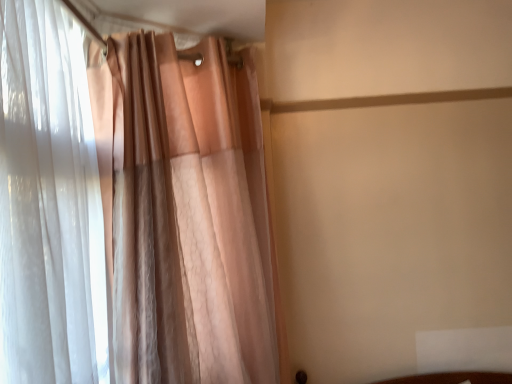
Where is `translucent pink curtain at left, which is counted as the second curtain, starting from the left`? This screenshot has height=384, width=512. translucent pink curtain at left, which is counted as the second curtain, starting from the left is located at coordinates (183, 212).

What do you see at coordinates (183, 212) in the screenshot?
I see `translucent pink curtain at left, which is counted as the second curtain, starting from the left` at bounding box center [183, 212].

In order to face translucent pink curtain at left, which is counted as the 1th curtain, starting from the right, should I rotate leftwards or rightwards?

A 4.002 degree turn to the left will do.

Measure the distance between translucent white curtain at left, which appears as the 1th curtain when viewed from the left, and camera.

They are 32.12 inches apart.

Describe the element at coordinates (49, 204) in the screenshot. The height and width of the screenshot is (384, 512). I see `translucent white curtain at left, the second curtain positioned from the right` at that location.

Find the location of a particular element. translucent white curtain at left, which appears as the 1th curtain when viewed from the left is located at coordinates (49, 204).

Locate an element on the screen. This screenshot has height=384, width=512. translucent pink curtain at left, which is counted as the second curtain, starting from the left is located at coordinates (183, 212).

In the image, is translucent pink curtain at left, which is counted as the second curtain, starting from the left, on the left side or the right side of translucent white curtain at left, which appears as the 1th curtain when viewed from the left?

Clearly, translucent pink curtain at left, which is counted as the second curtain, starting from the left, is on the right of translucent white curtain at left, which appears as the 1th curtain when viewed from the left, in the image.

Relative to translucent white curtain at left, the second curtain positioned from the right, is translucent pink curtain at left, which is counted as the second curtain, starting from the left, in front or behind?

In the image, translucent pink curtain at left, which is counted as the second curtain, starting from the left, appears behind translucent white curtain at left, the second curtain positioned from the right.

Does point (259, 349) lie in front of point (52, 161)?

No, (259, 349) is further to viewer.

From the image's perspective, is translucent pink curtain at left, which is counted as the 1th curtain, starting from the right, located beneath translucent white curtain at left, which appears as the 1th curtain when viewed from the left?

Yes.

From a real-world perspective, is translucent pink curtain at left, which is counted as the second curtain, starting from the left, physically located above or below translucent white curtain at left, which appears as the 1th curtain when viewed from the left?

Clearly, from a real-world perspective, translucent pink curtain at left, which is counted as the second curtain, starting from the left, is below translucent white curtain at left, which appears as the 1th curtain when viewed from the left.

Which of these two, translucent pink curtain at left, which is counted as the second curtain, starting from the left, or translucent white curtain at left, which appears as the 1th curtain when viewed from the left, is wider?

With larger width is translucent pink curtain at left, which is counted as the second curtain, starting from the left.

Considering the sizes of objects translucent pink curtain at left, which is counted as the 1th curtain, starting from the right, and translucent white curtain at left, which appears as the 1th curtain when viewed from the left, in the image provided, who is shorter, translucent pink curtain at left, which is counted as the 1th curtain, starting from the right, or translucent white curtain at left, which appears as the 1th curtain when viewed from the left,?

translucent white curtain at left, which appears as the 1th curtain when viewed from the left, is shorter.

In terms of size, does translucent pink curtain at left, which is counted as the 1th curtain, starting from the right, appear bigger or smaller than translucent white curtain at left, which appears as the 1th curtain when viewed from the left?

In the image, translucent pink curtain at left, which is counted as the 1th curtain, starting from the right, appears to be larger than translucent white curtain at left, which appears as the 1th curtain when viewed from the left.

Is translucent white curtain at left, the second curtain positioned from the right, located within translucent pink curtain at left, which is counted as the 1th curtain, starting from the right?

Yes, translucent pink curtain at left, which is counted as the 1th curtain, starting from the right, is surrounding translucent white curtain at left, the second curtain positioned from the right.

Is translucent pink curtain at left, which is counted as the second curtain, starting from the left, with translucent white curtain at left, which appears as the 1th curtain when viewed from the left?

No, translucent pink curtain at left, which is counted as the second curtain, starting from the left, is not in contact with translucent white curtain at left, which appears as the 1th curtain when viewed from the left.

Is translucent pink curtain at left, which is counted as the 1th curtain, starting from the right, oriented away from translucent white curtain at left, which appears as the 1th curtain when viewed from the left?

No.

How distant is translucent pink curtain at left, which is counted as the second curtain, starting from the left, from translucent white curtain at left, which appears as the 1th curtain when viewed from the left?

A distance of 31.65 centimeters exists between translucent pink curtain at left, which is counted as the second curtain, starting from the left, and translucent white curtain at left, which appears as the 1th curtain when viewed from the left.

This screenshot has height=384, width=512. I want to click on curtain below the translucent white curtain at left, the second curtain positioned from the right (from the image's perspective), so click(183, 212).

Considering the positions of objects translucent white curtain at left, the second curtain positioned from the right, and translucent pink curtain at left, which is counted as the second curtain, starting from the left, in the image provided, who is more to the right, translucent white curtain at left, the second curtain positioned from the right, or translucent pink curtain at left, which is counted as the second curtain, starting from the left,?

From the viewer's perspective, translucent pink curtain at left, which is counted as the second curtain, starting from the left, appears more on the right side.

Which object is closer to the camera taking this photo, translucent white curtain at left, the second curtain positioned from the right, or translucent pink curtain at left, which is counted as the second curtain, starting from the left?

translucent white curtain at left, the second curtain positioned from the right.

Which point is more distant from viewer, (x=50, y=94) or (x=108, y=151)?

Point (x=108, y=151)

From the image's perspective, does translucent white curtain at left, the second curtain positioned from the right, appear lower than translucent pink curtain at left, which is counted as the 1th curtain, starting from the right?

Actually, translucent white curtain at left, the second curtain positioned from the right, appears above translucent pink curtain at left, which is counted as the 1th curtain, starting from the right, in the image.

From a real-world perspective, is translucent white curtain at left, which appears as the 1th curtain when viewed from the left, positioned under translucent pink curtain at left, which is counted as the second curtain, starting from the left, based on gravity?

No, from a real-world perspective, translucent white curtain at left, which appears as the 1th curtain when viewed from the left, is not beneath translucent pink curtain at left, which is counted as the second curtain, starting from the left.

Which object is thinner, translucent white curtain at left, which appears as the 1th curtain when viewed from the left, or translucent pink curtain at left, which is counted as the second curtain, starting from the left?

translucent white curtain at left, which appears as the 1th curtain when viewed from the left, is thinner.

Between translucent white curtain at left, which appears as the 1th curtain when viewed from the left, and translucent pink curtain at left, which is counted as the second curtain, starting from the left, which one has more height?

With more height is translucent pink curtain at left, which is counted as the second curtain, starting from the left.

Looking at the image, does translucent white curtain at left, which appears as the 1th curtain when viewed from the left, seem bigger or smaller compared to translucent pink curtain at left, which is counted as the second curtain, starting from the left?

In the image, translucent white curtain at left, which appears as the 1th curtain when viewed from the left, appears to be smaller than translucent pink curtain at left, which is counted as the second curtain, starting from the left.

Is translucent white curtain at left, the second curtain positioned from the right, located outside translucent pink curtain at left, which is counted as the second curtain, starting from the left?

No.

Is there a large distance between translucent white curtain at left, which appears as the 1th curtain when viewed from the left, and translucent pink curtain at left, which is counted as the 1th curtain, starting from the right?

translucent white curtain at left, which appears as the 1th curtain when viewed from the left, is near translucent pink curtain at left, which is counted as the 1th curtain, starting from the right, not far away.

Could you tell me if translucent white curtain at left, which appears as the 1th curtain when viewed from the left, is turned towards translucent pink curtain at left, which is counted as the second curtain, starting from the left?

Yes, translucent white curtain at left, which appears as the 1th curtain when viewed from the left, is oriented towards translucent pink curtain at left, which is counted as the second curtain, starting from the left.

Can you tell me how much translucent white curtain at left, the second curtain positioned from the right, and translucent pink curtain at left, which is counted as the 1th curtain, starting from the right, differ in facing direction?

There is a 47-degree angle between the facing directions of translucent white curtain at left, the second curtain positioned from the right, and translucent pink curtain at left, which is counted as the 1th curtain, starting from the right.

The width and height of the screenshot is (512, 384). Identify the location of curtain that is under the translucent white curtain at left, which appears as the 1th curtain when viewed from the left (from a real-world perspective). (183, 212).

What are the coordinates of `curtain lying below the translucent white curtain at left, the second curtain positioned from the right (from the image's perspective)` in the screenshot? It's located at (183, 212).

The height and width of the screenshot is (384, 512). In order to click on curtain to the left of translucent pink curtain at left, which is counted as the second curtain, starting from the left in this screenshot , I will do `click(49, 204)`.